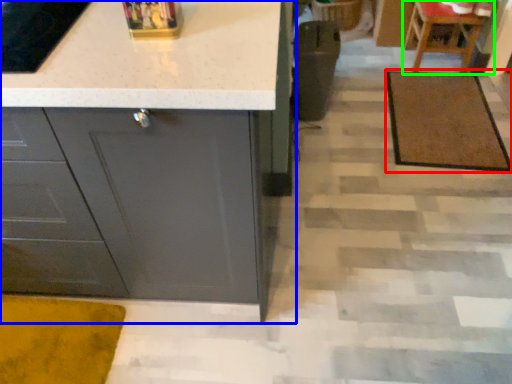
Question: Which is nearer to the doormat (highlighted by a red box)? cabinetry (highlighted by a blue box) or chair (highlighted by a green box).

Choices:
 (A) cabinetry
 (B) chair

Answer: (B)